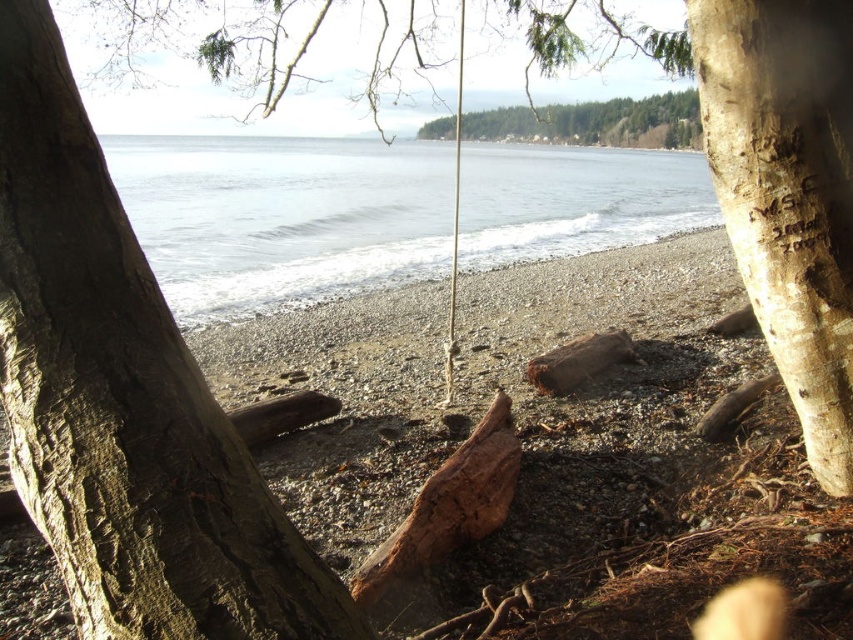
You are an artist setting up an easel to paint the coastal scene. You want to focus on the smooth brown driftwood at center and the green textured forest at upper center. Which of these two objects will appear smaller in your painting?

The smooth brown driftwood at center will appear smaller in the painting because it occupies less space than the green textured forest at upper center according to the description.

You are standing in front of the tree and want to touch both the brown rough bark at center and the light brown bark tree trunk at right. Which one would you need to reach toward the left to touch?

The brown rough bark at center is positioned on the left side of light brown bark tree trunk at right, so to touch it you would need to reach toward the left.